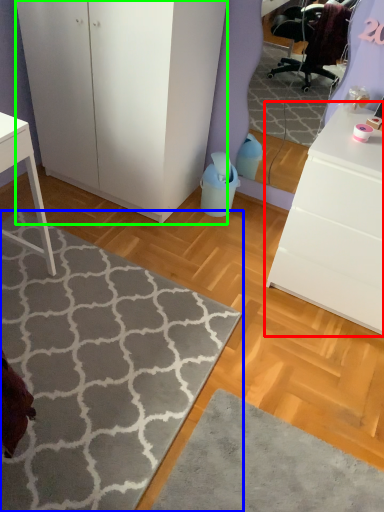
Question: Estimate the real-world distances between objects in this image. Which object is closer to chest of drawers (highlighted by a red box), doormat (highlighted by a blue box) or cabinetry (highlighted by a green box)?

Choices:
 (A) doormat
 (B) cabinetry

Answer: (A)